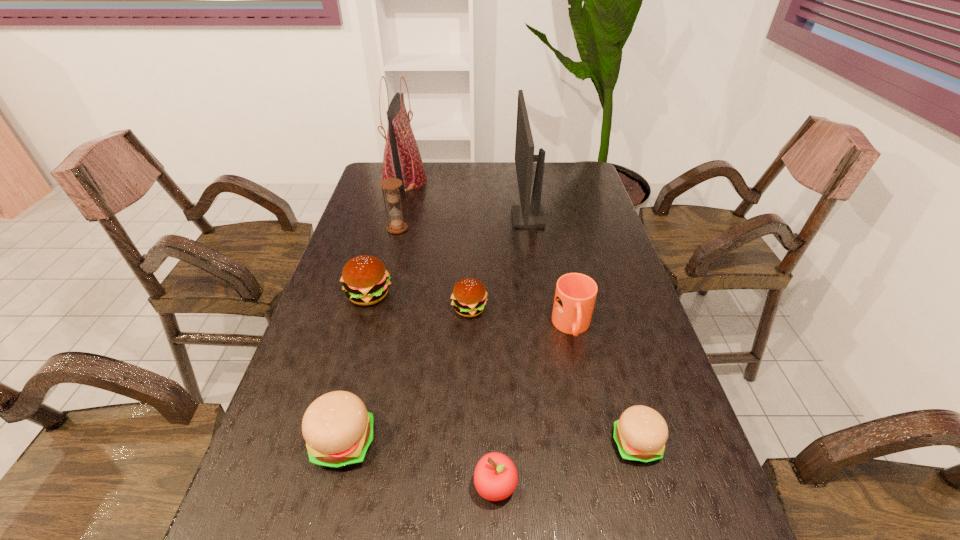
The height and width of the screenshot is (540, 960). What are the coordinates of `vacant area situated on the left of the apple` in the screenshot? It's located at (447, 486).

The width and height of the screenshot is (960, 540). I want to click on free point located 0.210m on the back of the right brown hamburger, so click(x=471, y=250).

Locate an element on the screen. Image resolution: width=960 pixels, height=540 pixels. free space located 0.060m on the back of the right beige hamburger is located at coordinates (624, 399).

Find the location of `handbag situated at the far edge`. handbag situated at the far edge is located at coordinates (402, 160).

Where is `computer monitor at the far edge`? This screenshot has width=960, height=540. computer monitor at the far edge is located at coordinates (527, 215).

Find the location of a particular element. The width and height of the screenshot is (960, 540). handbag that is at the left edge is located at coordinates (402, 160).

Where is `hourglass present at the left edge`? This screenshot has height=540, width=960. hourglass present at the left edge is located at coordinates (397, 225).

I want to click on mug present at the right edge, so click(575, 295).

The height and width of the screenshot is (540, 960). I want to click on hamburger located in the right edge section of the desktop, so click(x=640, y=434).

This screenshot has height=540, width=960. I want to click on object present at the far left corner, so click(402, 160).